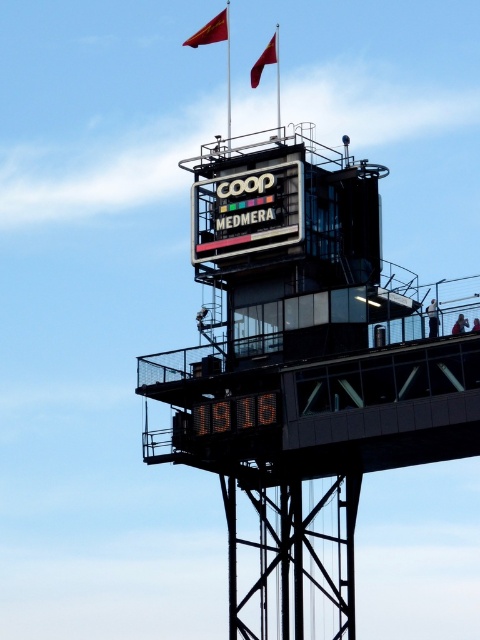
Is black glossy signboard at center positioned behind digital orange numbers at center?

That is True.

Measure the distance between black glossy signboard at center and digital orange numbers at center.

The distance of black glossy signboard at center from digital orange numbers at center is 10.85 meters.

Where is `black glossy signboard at center`? black glossy signboard at center is located at coordinates (247, 211).

Does black metal sign at upper center appear under black glossy signboard at center?

Yes, black metal sign at upper center is below black glossy signboard at center.

Between black metal sign at upper center and black glossy signboard at center, which one appears on the left side from the viewer's perspective?

From the viewer's perspective, black glossy signboard at center appears more on the left side.

You are a GUI agent. You are given a task and a screenshot of the screen. Output one action in this format:
    pyautogui.click(x=<x>, y=<y>)
    Task: Click on the black metal sign at upper center
    This screenshot has height=640, width=480.
    Given the screenshot: What is the action you would take?
    pyautogui.click(x=307, y=371)

Image resolution: width=480 pixels, height=640 pixels. Identify the location of black metal sign at upper center. (307, 371).

Can you confirm if black metal sign at upper center is thinner than digital orange numbers at center?

Incorrect, black metal sign at upper center's width is not less than digital orange numbers at center's.

Which is in front, point (478, 348) or point (208, 419)?

Positioned in front is point (478, 348).

At what (x,y) coordinates should I click in order to perform the action: click on black metal sign at upper center. Please return your answer as a coordinate pair (x, y). Looking at the image, I should click on [307, 371].